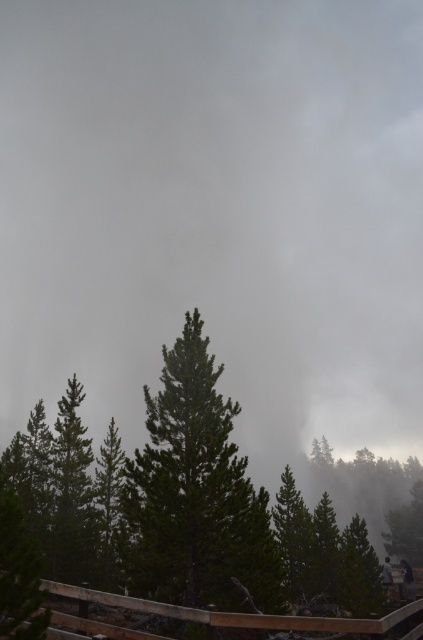
You are a photographer standing at the viewing platform with a camera. You want to capture a closeup shot of the green matte tree at center. Given that your camera has a minimum focusing distance of 2 meters, will you be able to take the photo without moving closer?

The distance between the green matte tree at center and the camera is 15.86 meters, which is greater than the camera minimum focusing distance of 2 meters. Therefore, you can take the closeup shot without moving closer.

In the scene shown: You are standing on the wooden railing at the viewing platform and looking out into the forest. You notice two points in the distance. The first point is located at coordinates point (x=156, y=596) and the second point is at point (x=263, y=618). Which point is closer to you?

Point (x=156, y=596) is closer to you because it is further to the camera than point (x=263, y=618).